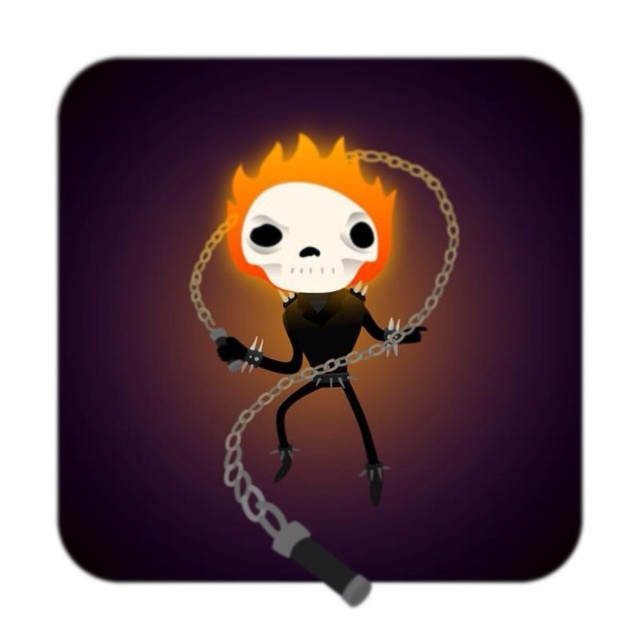
Looking at this image, between translucent white skull at center and metallic chain at center, which one is positioned higher?

Positioned higher is translucent white skull at center.

Where is `translucent white skull at center`? translucent white skull at center is located at coordinates (353, 369).

Locate an element on the screen. Image resolution: width=640 pixels, height=640 pixels. translucent white skull at center is located at coordinates (353, 369).